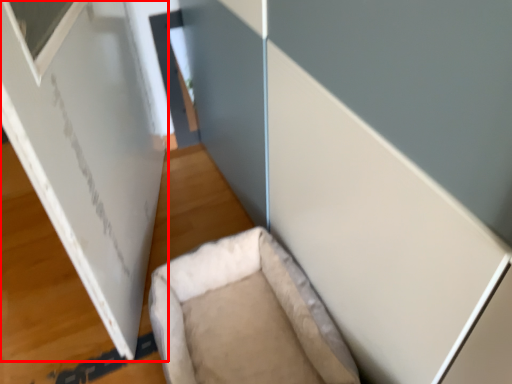
Question: From the image's perspective, considering the relative positions of bulletin board (annotated by the red box) and furniture in the image provided, where is bulletin board (annotated by the red box) located with respect to the staircase?

Choices:
 (A) above
 (B) below

Answer: (A)